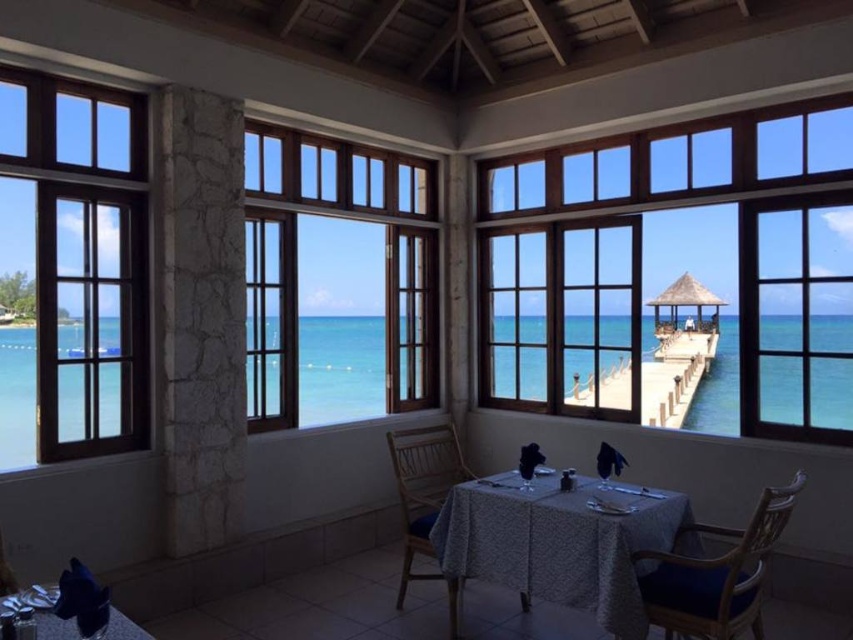
Measure the distance between wooden frame at right and camera.

wooden frame at right and camera are 10.74 meters apart from each other.

Between wooden frame at right and wooden chair at center, which one is positioned lower?

wooden chair at center is below.

Does point (579, 240) come behind point (432, 493)?

Yes.

This screenshot has width=853, height=640. Identify the location of wooden frame at right. (677, 269).

Who is more forward, (521, 348) or (747, 614)?

Point (747, 614)

Is wooden frame at right positioned in front of wooden chair at lower right?

No.

What do you see at coordinates (677, 269) in the screenshot?
I see `wooden frame at right` at bounding box center [677, 269].

At what (x,y) coordinates should I click in order to perform the action: click on wooden frame at right. Please return your answer as a coordinate pair (x, y). The height and width of the screenshot is (640, 853). Looking at the image, I should click on (677, 269).

In the scene shown: Does white lace tablecloth at center appear over wooden chair at center?

Correct, white lace tablecloth at center is located above wooden chair at center.

Does point (520, 564) lie in front of point (415, 573)?

Yes, it is.

Where is `white lace tablecloth at center`? The image size is (853, 640). white lace tablecloth at center is located at coordinates (556, 541).

The height and width of the screenshot is (640, 853). In order to click on white lace tablecloth at center in this screenshot , I will do `click(556, 541)`.